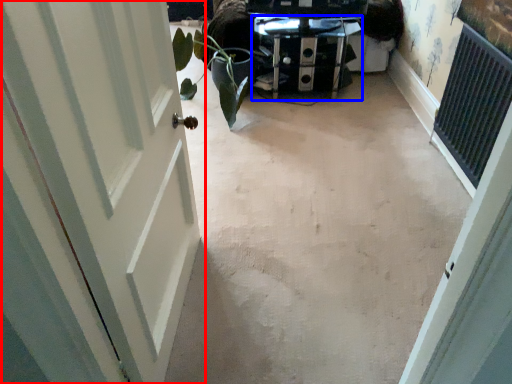
Question: Which of the following is the closest to the observer, door (highlighted by a red box) or furniture (highlighted by a blue box)?

Choices:
 (A) door
 (B) furniture

Answer: (A)